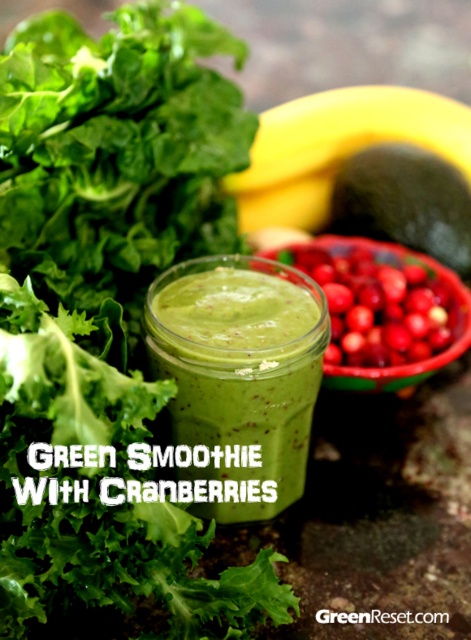
Is yellow matte banana at upper center above green matte avocado at center right?

Yes.

Is yellow matte banana at upper center smaller than green matte avocado at center right?

No, yellow matte banana at upper center is not smaller than green matte avocado at center right.

Does point (359, 208) lie behind point (380, 193)?

Yes, it is.

Find the location of a particular element. This screenshot has width=471, height=640. yellow matte banana at upper center is located at coordinates (365, 168).

Can you confirm if green matte smoothie at center is smaller than yellow matte banana at upper center?

Yes, green matte smoothie at center is smaller than yellow matte banana at upper center.

Measure the distance between point (252, 340) and camera.

A distance of 13.78 inches exists between point (252, 340) and camera.

Is point (276, 307) positioned in front of point (349, 166)?

That is True.

Find the location of a particular element. green matte smoothie at center is located at coordinates (237, 380).

Who is shorter, green matte smoothie at center or red matte cranberries at center?

With less height is red matte cranberries at center.

Looking at this image, between green matte smoothie at center and red matte cranberries at center, which one appears on the right side from the viewer's perspective?

red matte cranberries at center

This screenshot has height=640, width=471. Describe the element at coordinates (237, 380) in the screenshot. I see `green matte smoothie at center` at that location.

Where is `green matte smoothie at center`? green matte smoothie at center is located at coordinates (237, 380).